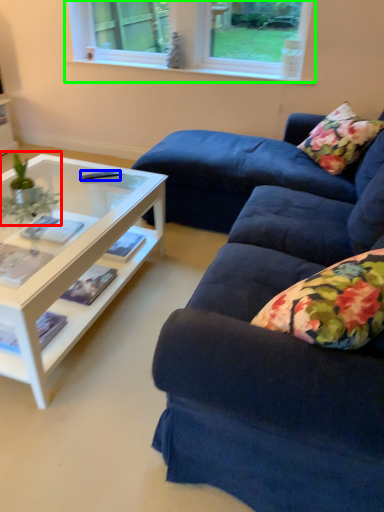
Question: Which object is the closest to the houseplant (highlighted by a red box)? Choose among these: remote control (highlighted by a blue box) or window (highlighted by a green box).

Choices:
 (A) remote control
 (B) window

Answer: (A)